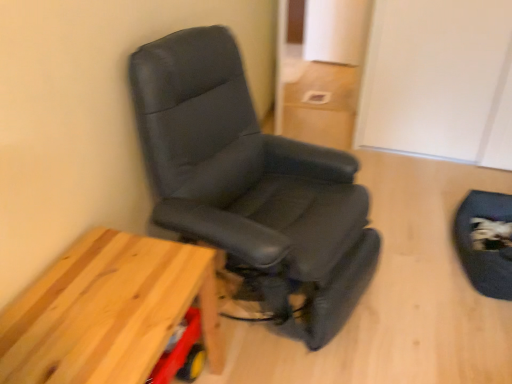
The width and height of the screenshot is (512, 384). In order to click on vacant area on top of wooden table at lower left (from a real-world perspective) in this screenshot , I will do `click(92, 314)`.